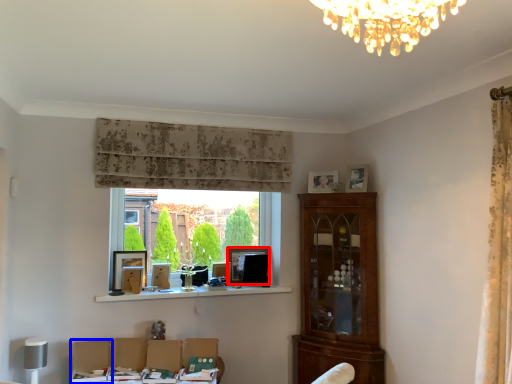
Question: Among these objects, which one is farthest to the camera, picture frame (highlighted by a red box) or swivel chair (highlighted by a blue box)?

Choices:
 (A) picture frame
 (B) swivel chair

Answer: (A)